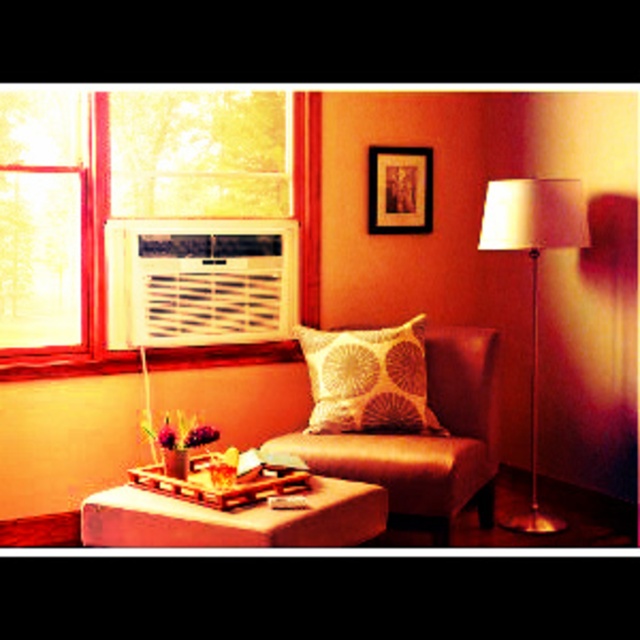
You are standing in the room and want to place a small potted plant with vibrant purple on the wooden tray at lower center. According to the coordinates provided, where exactly should you place the plant?

The wooden tray at lower center is located at coordinates point (234, 509), so you should place the small potted plant with vibrant purple there.